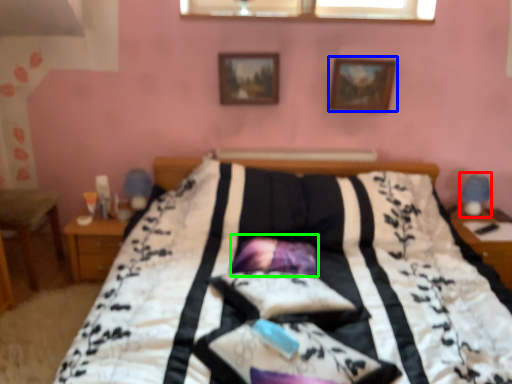
Question: Which object is the farthest from table lamp (highlighted by a red box)? Choose among these: picture frame (highlighted by a blue box) or pillow (highlighted by a green box).

Choices:
 (A) picture frame
 (B) pillow

Answer: (B)